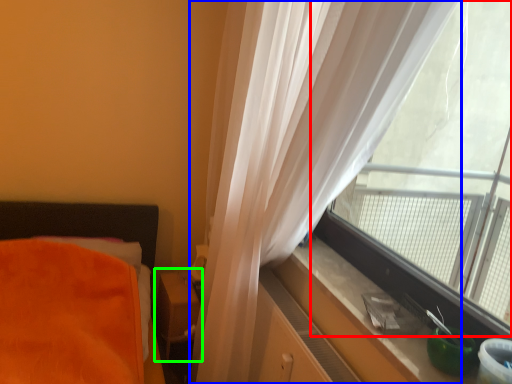
Question: Which is farther away from window (highlighted by a red box)? curtain (highlighted by a blue box) or table (highlighted by a green box)?

Choices:
 (A) curtain
 (B) table

Answer: (B)